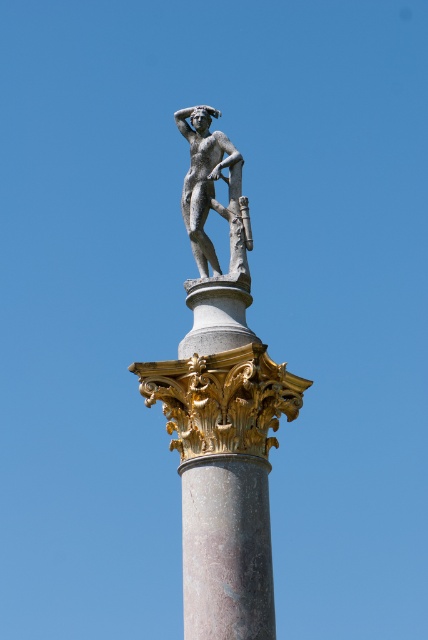
You are an art student analyzing the composition of the image. You notice the marble column at center and the polished bronze statue at top. Based on their positions, which object is positioned to the right side of the other?

The marble column at center is to the left of polished bronze statue at top, so the polished bronze statue at top is positioned to the right side of the marble column at center.

You are standing in front of the classical statue and want to take a photo. You notice two points on the statue labeled as point (210, 560) and point (204, 122). Which point is closer to your camera lens?

Point (210, 560) is closer to the camera than point (204, 122).